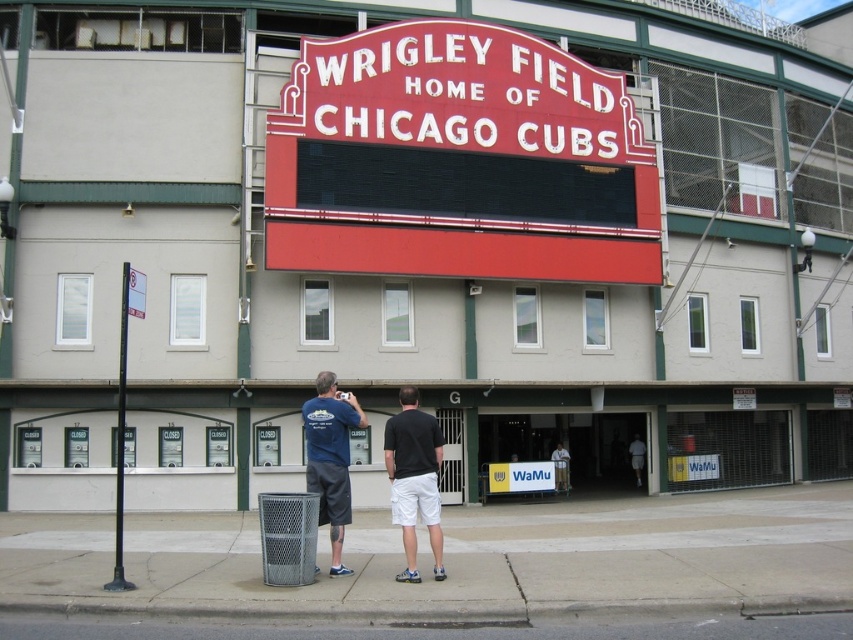
Question: Among these objects, which one is nearest to the camera?

Choices:
 (A) red matte sign at center
 (B) black cotton shorts at center
 (C) dark blue t-shirt at center

Answer: (C)

Question: Which point is closer to the camera?

Choices:
 (A) black cotton shorts at center
 (B) dark blue t-shirt at center
 (C) matte blue t-shirt at center

Answer: (B)

Question: Does dark blue t-shirt at center have a smaller size compared to black cotton shorts at center?

Choices:
 (A) yes
 (B) no

Answer: (A)

Question: Which object is farther from the camera taking this photo?

Choices:
 (A) matte blue t-shirt at center
 (B) black cotton shorts at center
 (C) red matte sign at center
 (D) dark blue t-shirt at center

Answer: (C)

Question: Does dark blue t-shirt at center appear on the left side of black cotton shorts at center?

Choices:
 (A) yes
 (B) no

Answer: (A)

Question: Does red matte sign at center have a lesser width compared to black cotton shorts at center?

Choices:
 (A) yes
 (B) no

Answer: (B)